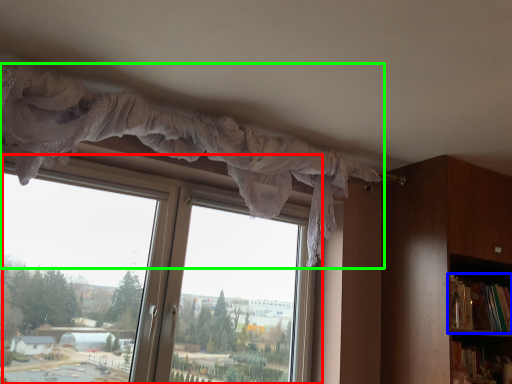
Question: Estimate the real-world distances between objects in this image. Which object is farther from window (highlighted by a red box), book (highlighted by a blue box) or curtain (highlighted by a green box)?

Choices:
 (A) book
 (B) curtain

Answer: (A)